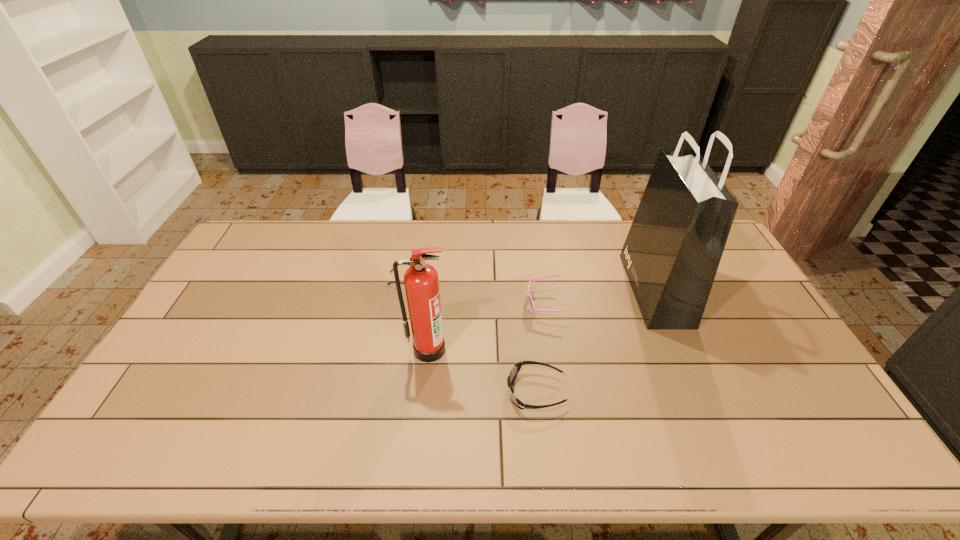
The image size is (960, 540). I want to click on vacant space at the far edge, so click(x=426, y=237).

Where is `vacant space at the near edge of the desktop`? This screenshot has height=540, width=960. vacant space at the near edge of the desktop is located at coordinates (690, 438).

In the image, there is a desktop. Find the location of `free space at the left edge`. free space at the left edge is located at coordinates [x=186, y=387].

The image size is (960, 540). Identify the location of vacant space at the right edge of the desktop. [x=775, y=327].

What are the coordinates of `free space between the second tallest object and the rightmost object` in the screenshot? It's located at (541, 319).

Identify the location of empty space that is in between the shortest object and the nearest object. This screenshot has width=960, height=540. (470, 335).

Identify the location of vacant area between the shopping bag and the third tallest object. The height and width of the screenshot is (540, 960). click(599, 296).

Find the location of a particular element. free space between the third shortest object and the rightmost object is located at coordinates [x=599, y=296].

I want to click on vacant area that lies between the shortest sunglasses and the tallest sunglasses, so click(474, 292).

The width and height of the screenshot is (960, 540). In order to click on free space between the tallest object and the tallest sunglasses in this screenshot , I will do `click(599, 296)`.